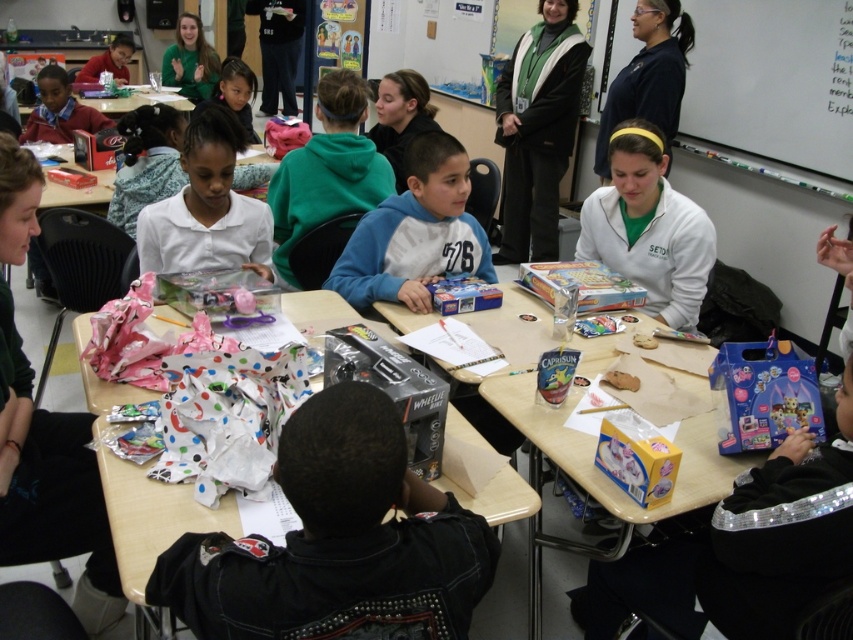
Can you confirm if green fleece hoodie at upper center is taller than white paper at center?

Yes, green fleece hoodie at upper center is taller than white paper at center.

Which of these two, green fleece hoodie at upper center or white paper at center, stands shorter?

white paper at center

Between point (323, 109) and point (83, 362), which one is positioned in front?

Positioned in front is point (83, 362).

I want to click on green fleece hoodie at upper center, so click(x=326, y=170).

Who is more distant from viewer, (111, 400) or (165, 99)?

The point (165, 99) is behind.

Identify the location of white paper at center. (328, 316).

Can you confirm if yellow cardboard table at center is shorter than white paper at center?

No, yellow cardboard table at center is not shorter than white paper at center.

Which is in front, point (508, 273) or point (397, 344)?

Point (397, 344)

Describe the element at coordinates (590, 435) in the screenshot. The image size is (853, 640). I see `yellow cardboard table at center` at that location.

What are the coordinates of `yellow cardboard table at center` in the screenshot? It's located at (590, 435).